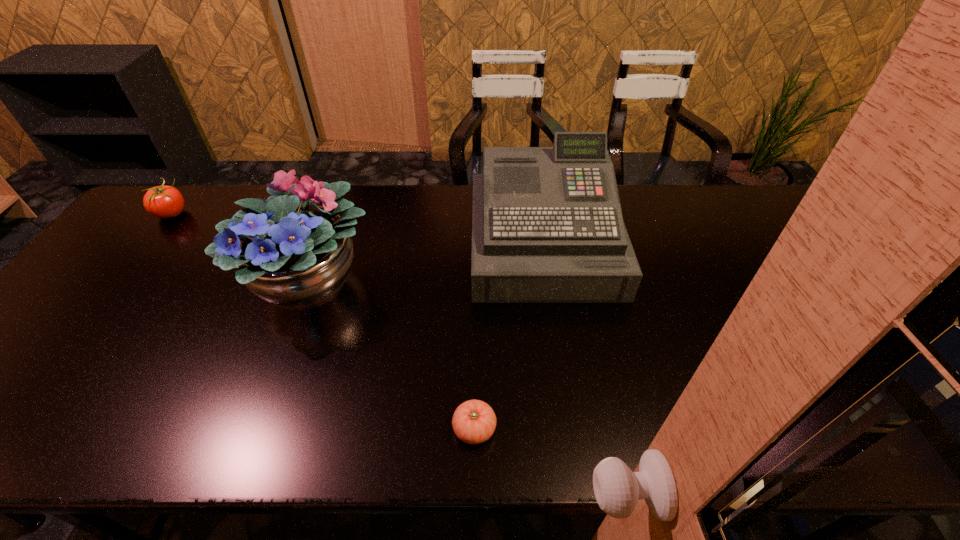
Locate an element on the screen. This screenshot has height=540, width=960. cash register located in the far edge section of the desktop is located at coordinates (547, 227).

Locate an element on the screen. tomato positioned at the far edge is located at coordinates (163, 201).

Where is `object at the near edge`? This screenshot has height=540, width=960. object at the near edge is located at coordinates (474, 421).

In order to click on object that is at the left edge in this screenshot , I will do `click(163, 201)`.

Find the location of a particular element. The height and width of the screenshot is (540, 960). object that is at the far left corner is located at coordinates (x=163, y=201).

Locate an element on the screen. vacant space at the far edge of the desktop is located at coordinates (391, 187).

Locate an element on the screen. The height and width of the screenshot is (540, 960). blank space at the near edge of the desktop is located at coordinates (698, 416).

Identify the location of vacant space at the left edge of the desktop. The image size is (960, 540). (125, 251).

Image resolution: width=960 pixels, height=540 pixels. In the image, there is a desktop. In order to click on blank space at the far right corner in this screenshot , I will do `click(785, 226)`.

The image size is (960, 540). Find the location of `free spot between the nearer tomato and the third object from right to left`. free spot between the nearer tomato and the third object from right to left is located at coordinates (393, 356).